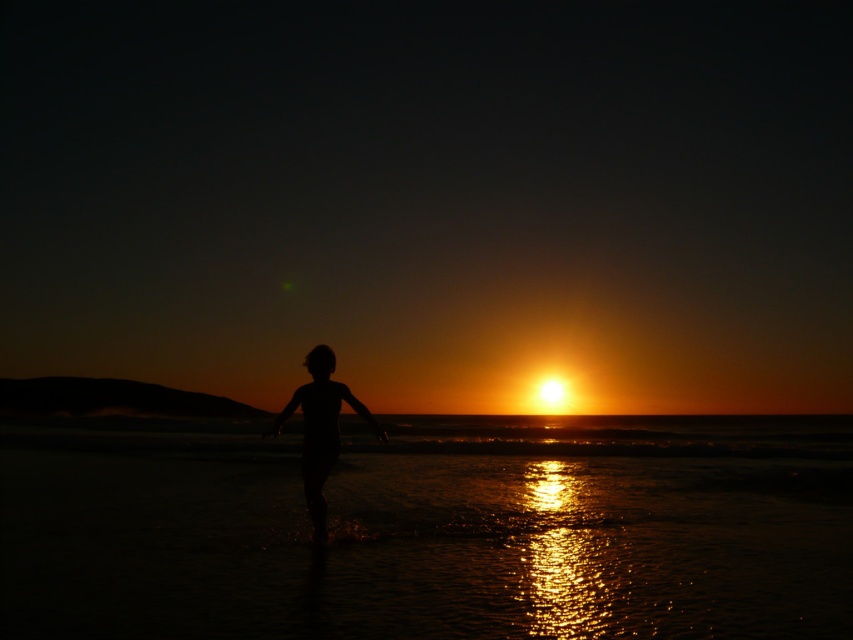
Can you confirm if shiny golden water at center is wider than silhouette skin at center?

Yes, shiny golden water at center is wider than silhouette skin at center.

Who is more distant from viewer, (219,529) or (329,449)?

The point (219,529) is behind.

Which is behind, point (143, 557) or point (312, 406)?

Positioned behind is point (312, 406).

Where is `shiny golden water at center`? shiny golden water at center is located at coordinates (434, 532).